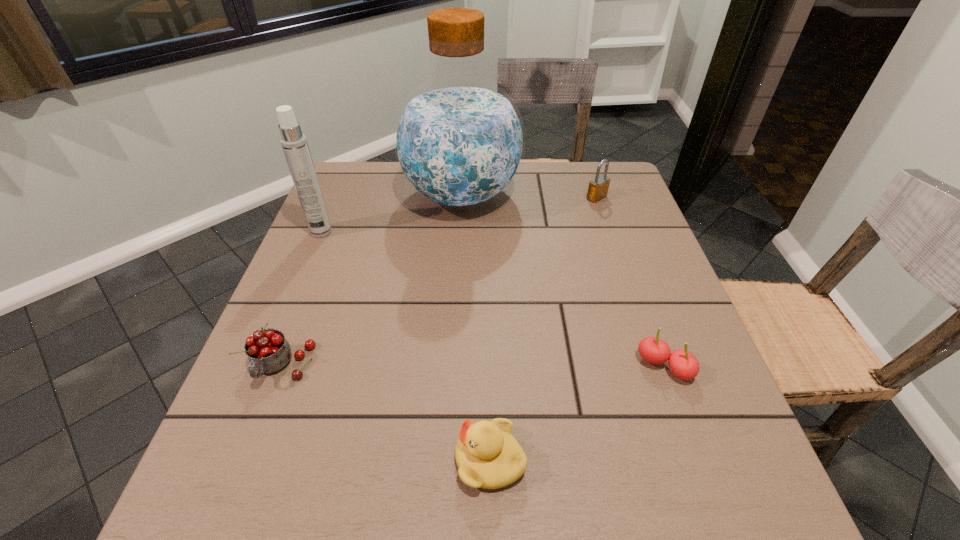
Find the location of a particular element. vacant space located on the front-facing side of the duckling is located at coordinates (299, 460).

Identify the location of vacant space located 0.210m on the front-facing side of the duckling. The height and width of the screenshot is (540, 960). (318, 460).

The image size is (960, 540). Identify the location of free space located on the front-facing side of the duckling. (299, 460).

Where is `vacant space located on the left of the shorter cherry`? Image resolution: width=960 pixels, height=540 pixels. vacant space located on the left of the shorter cherry is located at coordinates (439, 367).

In order to click on water jug located at the far edge in this screenshot , I will do `click(459, 139)`.

The image size is (960, 540). I want to click on padlock at the far edge, so click(x=598, y=187).

At what (x,y) coordinates should I click in order to perform the action: click on object located in the near edge section of the desktop. Please return your answer as a coordinate pair (x, y). Looking at the image, I should click on (488, 456).

Locate an element on the screen. The width and height of the screenshot is (960, 540). aerosol can that is at the left edge is located at coordinates (294, 143).

You are a GUI agent. You are given a task and a screenshot of the screen. Output one action in this format:
    pyautogui.click(x=<x>, y=<y>)
    Task: Click on the cherry that is positioned at the left edge
    Image resolution: width=960 pixels, height=540 pixels.
    Given the screenshot: What is the action you would take?
    pyautogui.click(x=268, y=351)

Where is `padlock that is at the right edge`? This screenshot has height=540, width=960. padlock that is at the right edge is located at coordinates (598, 187).